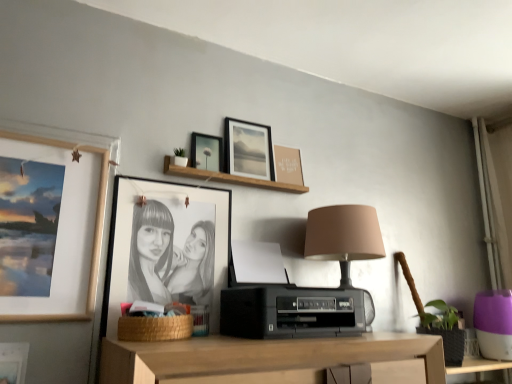
Describe the element at coordinates (294, 312) in the screenshot. I see `black plastic printer at center` at that location.

What do you see at coordinates (206, 152) in the screenshot? The height and width of the screenshot is (384, 512). I see `matte black picture frame at upper center, the 4th picture frame from the left` at bounding box center [206, 152].

This screenshot has width=512, height=384. What do you see at coordinates (66, 232) in the screenshot?
I see `matte wooden picture frame at left, which appears as the 2th picture frame when viewed from the left` at bounding box center [66, 232].

Where is `black plastic printer at center`? The image size is (512, 384). black plastic printer at center is located at coordinates (294, 312).

Is wooden shelf at upper center outside of matte black picture frame at upper left, which is the first picture frame in left-to-right order?

Absolutely, wooden shelf at upper center is external to matte black picture frame at upper left, which is the first picture frame in left-to-right order.

Is wooden shelf at upper center far away from matte black picture frame at upper left, which ranks as the 6th picture frame in right-to-left order?

wooden shelf at upper center is actually quite close to matte black picture frame at upper left, which ranks as the 6th picture frame in right-to-left order.

Is wooden shelf at upper center thinner than matte black picture frame at upper left, which is the first picture frame in left-to-right order?

No.

Can you confirm if wooden shelf at upper center is positioned to the right of matte black picture frame at upper left, which ranks as the 6th picture frame in right-to-left order?

Correct, you'll find wooden shelf at upper center to the right of matte black picture frame at upper left, which ranks as the 6th picture frame in right-to-left order.

Is the depth of black matte picture frame at center, marked as the third picture frame in a left-to-right arrangement, less than that of black plastic printer at center?

No, black matte picture frame at center, marked as the third picture frame in a left-to-right arrangement, is further to the viewer.

Based on the photo, from the image's perspective, which one is positioned higher, black matte picture frame at center, which appears as the fourth picture frame when viewed from the right, or black plastic printer at center?

black matte picture frame at center, which appears as the fourth picture frame when viewed from the right.

Where is `the 1st picture frame positioned above the black plastic printer at center (from a real-world perspective)`? The image size is (512, 384). the 1st picture frame positioned above the black plastic printer at center (from a real-world perspective) is located at coordinates [x=165, y=245].

Which of these two, black matte picture frame at center, which appears as the fourth picture frame when viewed from the right, or black plastic printer at center, is wider?

With larger width is black plastic printer at center.

Which object is closer to the camera taking this photo, matte brown picture frame at upper center, which is counted as the sixth picture frame, starting from the left, or woven brown basket at lower center?

woven brown basket at lower center.

Measure the distance between matte brown picture frame at upper center, which appears as the 1th picture frame when viewed from the right, and woven brown basket at lower center.

A: matte brown picture frame at upper center, which appears as the 1th picture frame when viewed from the right, and woven brown basket at lower center are 29.64 inches apart from each other.

Does matte brown picture frame at upper center, which appears as the 1th picture frame when viewed from the right, have a greater width compared to woven brown basket at lower center?

Incorrect, the width of matte brown picture frame at upper center, which appears as the 1th picture frame when viewed from the right, does not surpass that of woven brown basket at lower center.

Is matte brown picture frame at upper center, which appears as the 1th picture frame when viewed from the right, oriented towards woven brown basket at lower center?

No, matte brown picture frame at upper center, which appears as the 1th picture frame when viewed from the right, is not oriented towards woven brown basket at lower center.

Is woven brown basket at lower center to the right of matte black picture frame at upper left, which is the first picture frame in left-to-right order, from the viewer's perspective?

Yes, woven brown basket at lower center is to the right of matte black picture frame at upper left, which is the first picture frame in left-to-right order.

How many degrees apart are the facing directions of woven brown basket at lower center and matte black picture frame at upper left, which is the first picture frame in left-to-right order?

0.708 degrees.

Is woven brown basket at lower center with matte black picture frame at upper left, which ranks as the 6th picture frame in right-to-left order?

woven brown basket at lower center and matte black picture frame at upper left, which ranks as the 6th picture frame in right-to-left order, are clearly separated.

Measure the distance between woven brown basket at lower center and matte black picture frame at upper left, which is the first picture frame in left-to-right order.

woven brown basket at lower center is 13.24 inches away from matte black picture frame at upper left, which is the first picture frame in left-to-right order.

Choose the correct answer: Is matte wooden picture frame at left, which appears as the 2th picture frame when viewed from the left, inside black matte picture frame at center, which appears as the fourth picture frame when viewed from the right, or outside it?

matte wooden picture frame at left, which appears as the 2th picture frame when viewed from the left, exists outside the volume of black matte picture frame at center, which appears as the fourth picture frame when viewed from the right.

Between matte wooden picture frame at left, which appears as the 2th picture frame when viewed from the left, and black matte picture frame at center, which appears as the fourth picture frame when viewed from the right, which one has smaller size?

black matte picture frame at center, which appears as the fourth picture frame when viewed from the right.

From a real-world perspective, which object rests below the other?

black matte picture frame at center, which appears as the fourth picture frame when viewed from the right.

From the image's perspective, between matte wooden picture frame at left, which appears as the fifth picture frame when viewed from the right, and black matte picture frame at center, which appears as the fourth picture frame when viewed from the right, who is located below?

Result: black matte picture frame at center, which appears as the fourth picture frame when viewed from the right, from the image's perspective.

In the scene shown: From a real-world perspective, is matte black picture frame at upper left, which ranks as the 6th picture frame in right-to-left order, below matte black picture frame at upper center, the 4th picture frame from the left?

Indeed, from a real-world perspective, matte black picture frame at upper left, which ranks as the 6th picture frame in right-to-left order, is positioned beneath matte black picture frame at upper center, the 4th picture frame from the left.

Looking at the image, does matte black picture frame at upper left, which is the first picture frame in left-to-right order, seem bigger or smaller compared to matte black picture frame at upper center, the 4th picture frame from the left?

Clearly, matte black picture frame at upper left, which is the first picture frame in left-to-right order, is larger in size than matte black picture frame at upper center, the 4th picture frame from the left.

Can you confirm if matte black picture frame at upper left, which is the first picture frame in left-to-right order, is taller than matte black picture frame at upper center, the 3th picture frame in the right-to-left sequence?

No.

Between matte black picture frame at upper left, which ranks as the 6th picture frame in right-to-left order, and matte black picture frame at upper center, the 4th picture frame from the left, which one has smaller width?

Thinner between the two is matte black picture frame at upper center, the 4th picture frame from the left.

Which of these two, matte black picture frame at upper center, arranged as the 5th picture frame when viewed from the left, or woven brown basket at lower center, is smaller?

Smaller between the two is matte black picture frame at upper center, arranged as the 5th picture frame when viewed from the left.

Considering the sizes of objects matte black picture frame at upper center, arranged as the 5th picture frame when viewed from the left, and woven brown basket at lower center in the image provided, who is thinner, matte black picture frame at upper center, arranged as the 5th picture frame when viewed from the left, or woven brown basket at lower center?

matte black picture frame at upper center, arranged as the 5th picture frame when viewed from the left.

Does matte black picture frame at upper center, which is counted as the 2th picture frame, starting from the right, have a lesser height compared to woven brown basket at lower center?

No.

Considering the positions of points (269, 157) and (144, 324), is point (269, 157) farther from camera compared to point (144, 324)?

Yes.

The image size is (512, 384). I want to click on shelf on the right of matte black picture frame at upper left, which is the first picture frame in left-to-right order, so click(229, 178).

You are a GUI agent. You are given a task and a screenshot of the screen. Output one action in this format:
    pyautogui.click(x=<x>, y=<y>)
    Task: Click on the stereo below the black matte picture frame at center, marked as the third picture frame in a left-to-right arrangement (from the image's perspective)
    This screenshot has height=384, width=512.
    Given the screenshot: What is the action you would take?
    pyautogui.click(x=294, y=312)

Which object lies further to the anchor point matte brown picture frame at upper center, which appears as the 1th picture frame when viewed from the right, matte black picture frame at upper center, arranged as the 5th picture frame when viewed from the left, or black matte picture frame at center, which appears as the fourth picture frame when viewed from the right?

The object further to matte brown picture frame at upper center, which appears as the 1th picture frame when viewed from the right, is black matte picture frame at center, which appears as the fourth picture frame when viewed from the right.

Looking at this image, when comparing their distances from matte black picture frame at upper center, the 4th picture frame from the left, does woven brown basket at lower center or black plastic printer at center seem further?

woven brown basket at lower center is positioned further to the anchor matte black picture frame at upper center, the 4th picture frame from the left.

Which object lies nearer to the anchor point woven brown basket at lower center, black matte picture frame at center, marked as the third picture frame in a left-to-right arrangement, or matte black picture frame at upper center, arranged as the 5th picture frame when viewed from the left?

Among the two, black matte picture frame at center, marked as the third picture frame in a left-to-right arrangement, is located nearer to woven brown basket at lower center.

Looking at the image, which one is located further to matte black picture frame at upper center, which is counted as the 2th picture frame, starting from the right, wooden shelf at upper center or black matte picture frame at center, which appears as the fourth picture frame when viewed from the right?

black matte picture frame at center, which appears as the fourth picture frame when viewed from the right.

Considering their positions, is black plastic printer at center positioned further to wooden shelf at upper center than matte brown picture frame at upper center, which is counted as the sixth picture frame, starting from the left?

Among the two, black plastic printer at center is located further to wooden shelf at upper center.

When comparing their distances from black matte picture frame at center, marked as the third picture frame in a left-to-right arrangement, does matte brown picture frame at upper center, which is counted as the sixth picture frame, starting from the left, or matte black picture frame at upper left, which ranks as the 6th picture frame in right-to-left order, seem further?

matte black picture frame at upper left, which ranks as the 6th picture frame in right-to-left order, is further to black matte picture frame at center, marked as the third picture frame in a left-to-right arrangement.

When comparing their distances from wooden shelf at upper center, does matte black picture frame at upper center, which is counted as the 2th picture frame, starting from the right, or matte wooden picture frame at left, which appears as the fifth picture frame when viewed from the right, seem closer?

Based on the image, matte black picture frame at upper center, which is counted as the 2th picture frame, starting from the right, appears to be nearer to wooden shelf at upper center.

Based on the photo, looking at the image, which one is located closer to matte wooden picture frame at left, which appears as the fifth picture frame when viewed from the right, matte black picture frame at upper center, arranged as the 5th picture frame when viewed from the left, or black matte picture frame at center, marked as the third picture frame in a left-to-right arrangement?

Among the two, black matte picture frame at center, marked as the third picture frame in a left-to-right arrangement, is located nearer to matte wooden picture frame at left, which appears as the fifth picture frame when viewed from the right.

Image resolution: width=512 pixels, height=384 pixels. I want to click on shelf between black matte picture frame at center, which appears as the fourth picture frame when viewed from the right, and matte brown picture frame at upper center, which is counted as the sixth picture frame, starting from the left, from left to right, so click(x=229, y=178).

Locate an element on the screen. basket located between matte wooden picture frame at left, which appears as the 2th picture frame when viewed from the left, and wooden shelf at upper center in the left-right direction is located at coordinates (155, 328).

Image resolution: width=512 pixels, height=384 pixels. Find the location of `shelf between matte wooden picture frame at left, which appears as the fifth picture frame when viewed from the right, and black plastic printer at center`. shelf between matte wooden picture frame at left, which appears as the fifth picture frame when viewed from the right, and black plastic printer at center is located at coordinates (229, 178).

The height and width of the screenshot is (384, 512). Find the location of `basket between matte black picture frame at upper center, the 3th picture frame in the right-to-left sequence, and black plastic printer at center vertically`. basket between matte black picture frame at upper center, the 3th picture frame in the right-to-left sequence, and black plastic printer at center vertically is located at coordinates (155, 328).